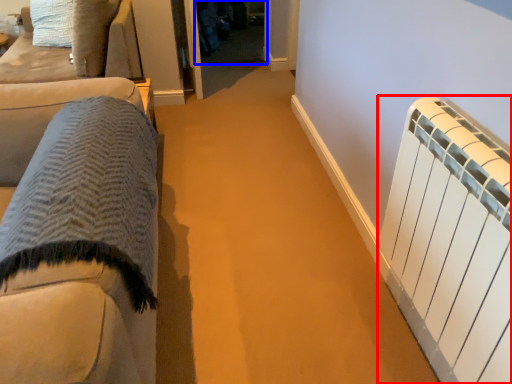
Question: Which point is closer to the camera, radiator (highlighted by a red box) or glass door (highlighted by a blue box)?

Choices:
 (A) radiator
 (B) glass door

Answer: (A)